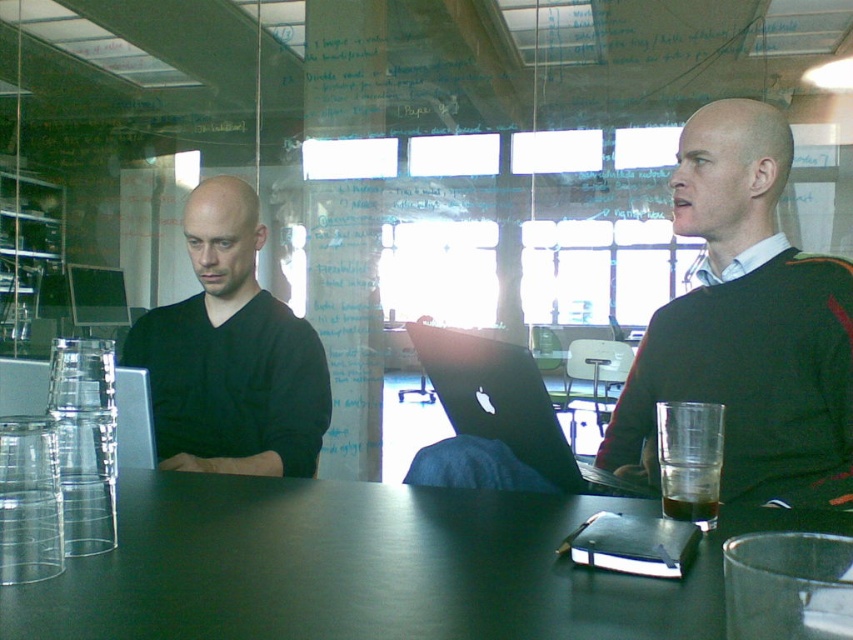
You are organizing a meeting in this office and need to place a new monitor on the table. The monitor requires a space of 30 cm in height to fit. Can the black matte laptop at center be moved to accommodate the monitor on the black matte table at center?

The black matte table at center is positioned under the black matte laptop at center, so moving the laptop would allow space for the monitor. However, the description does not provide the exact dimensions of the table or the laptop, so it is uncertain if the 30 cm height requirement is met. Further measurements are needed.

You are a delivery robot that needs to place a small package between the black matte sweater at center and the black matte laptop at center. The package is 14 inches long. Can you fit the package between them without moving either object?

The black matte sweater at center and black matte laptop at center are 14.14 inches apart from each other. Since the package is 14 inches long, which is shorter than the distance between them, the package can be placed between them without moving either object.

Please look at the scene and find the object located at point [231,355]. What is it?

The object at point [231,355] is the matte black laptop at left.